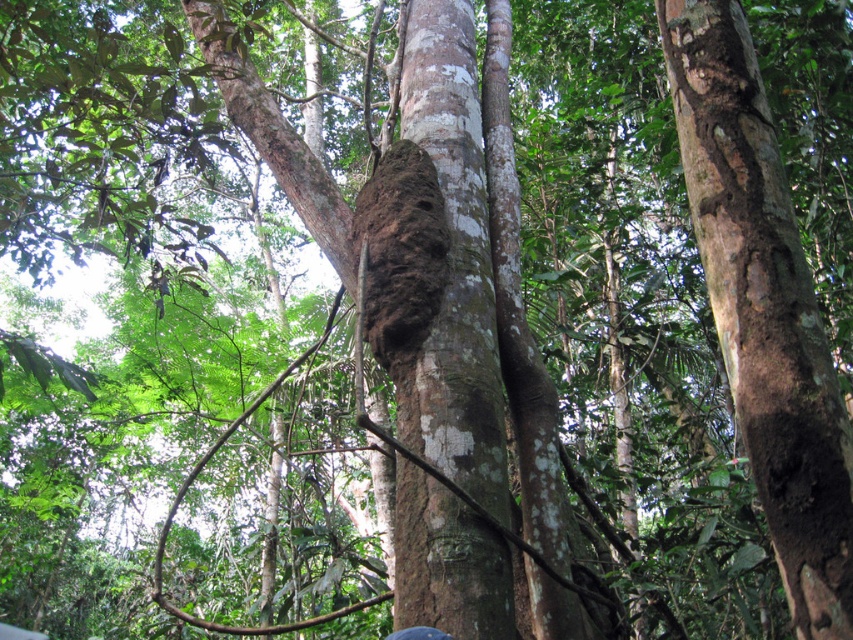
In the scene shown: You are navigating through a dense tropical forest and see two points marked in the scene. The first point is at coordinate point(720,138) and the second is at point(471,598). Which point is closer to you as you stand in the forest?

Point(720,138) is in front of point(471,598), so it is closer to you.